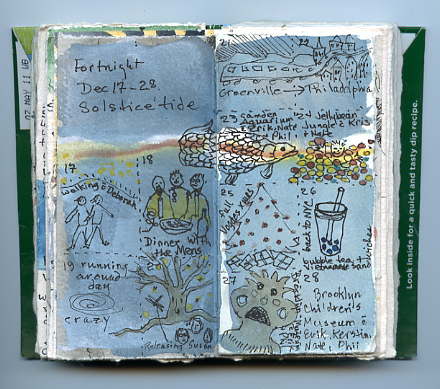
The image size is (440, 389). I want to click on cup, so click(x=331, y=229).